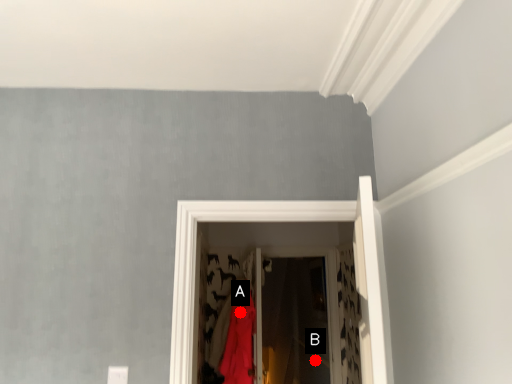
Question: Two points are circled on the image, labeled by A and B beside each circle. Which of the following is the closest to the observer?

Choices:
 (A) A is closer
 (B) B is closer

Answer: (A)